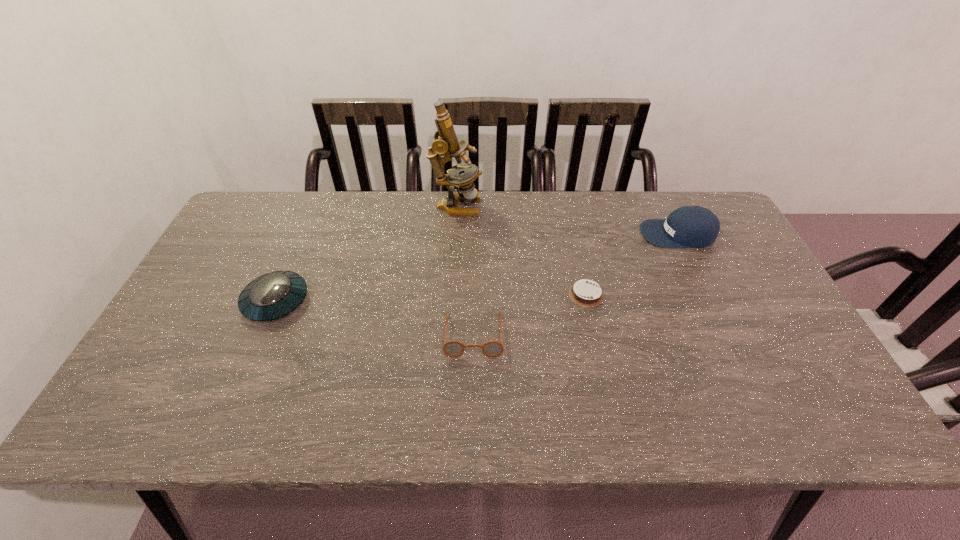
Find the location of a particular element. This screenshot has height=540, width=960. free space at the near edge is located at coordinates (454, 397).

The image size is (960, 540). I want to click on free space at the left edge of the desktop, so click(x=225, y=247).

The width and height of the screenshot is (960, 540). What are the coordinates of `vacant space at the right edge` in the screenshot? It's located at (759, 369).

Identify the location of vacant space at the far left corner of the desktop. (262, 232).

Locate an element on the screen. This screenshot has height=540, width=960. vacant space at the far right corner of the desktop is located at coordinates (682, 206).

Locate an element on the screen. vacant region between the leftmost object and the shortest object is located at coordinates (431, 298).

Find the location of `free spot between the leftmost object and the spectacles`. free spot between the leftmost object and the spectacles is located at coordinates (374, 318).

I want to click on empty space that is in between the farthest object and the spectacles, so click(x=465, y=271).

Where is `blank region between the leftmost object and the spectacles`? The image size is (960, 540). blank region between the leftmost object and the spectacles is located at coordinates (374, 318).

What are the coordinates of `vacant point located between the spectacles and the fourth object from left to right` in the screenshot? It's located at point(530,314).